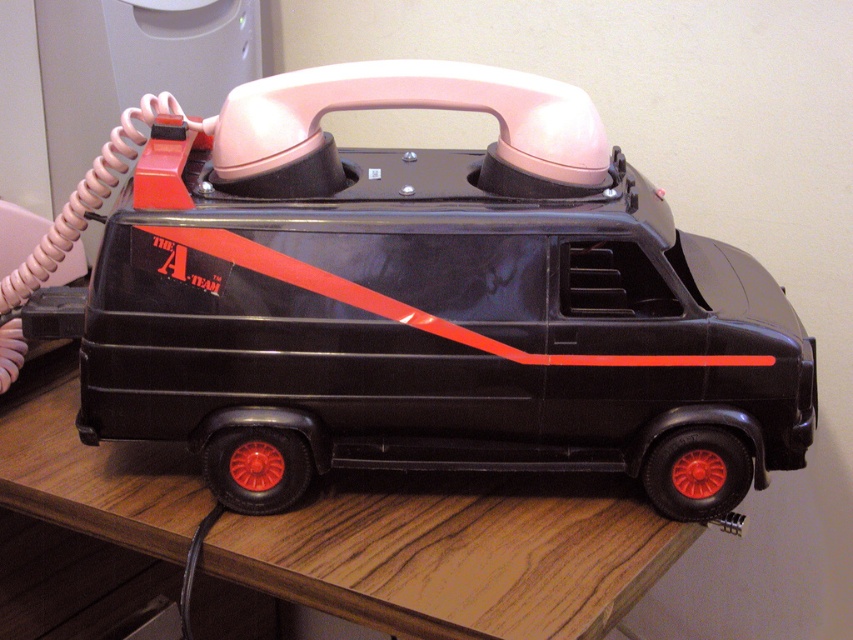
Question: Is black plastic van at center below wooden table at lower center?

Choices:
 (A) yes
 (B) no

Answer: (B)

Question: Is black plastic van at center to the right of wooden table at lower center from the viewer's perspective?

Choices:
 (A) yes
 (B) no

Answer: (A)

Question: Is black plastic van at center to the left of wooden table at lower center from the viewer's perspective?

Choices:
 (A) yes
 (B) no

Answer: (B)

Question: Which object appears farthest from the camera in this image?

Choices:
 (A) black plastic van at center
 (B) wooden table at lower center

Answer: (A)

Question: Which of the following is the farthest from the observer?

Choices:
 (A) wooden table at lower center
 (B) black plastic van at center

Answer: (B)